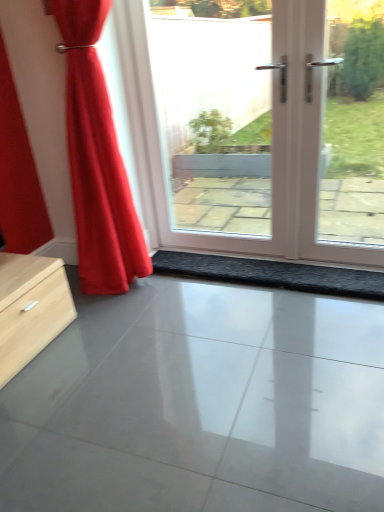
This screenshot has width=384, height=512. Identify the location of free space in front of satin red curtain at left. [x=132, y=322].